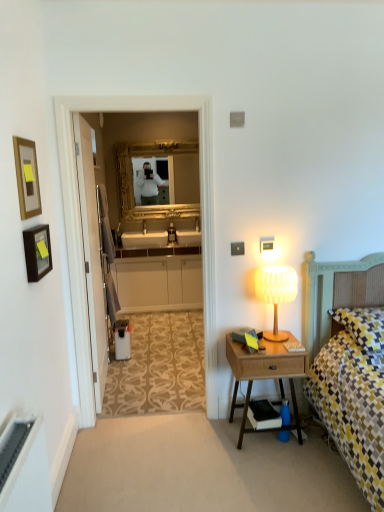
The width and height of the screenshot is (384, 512). I want to click on vacant region in front of woodenmaterial/texturenightstand at right, so click(x=283, y=467).